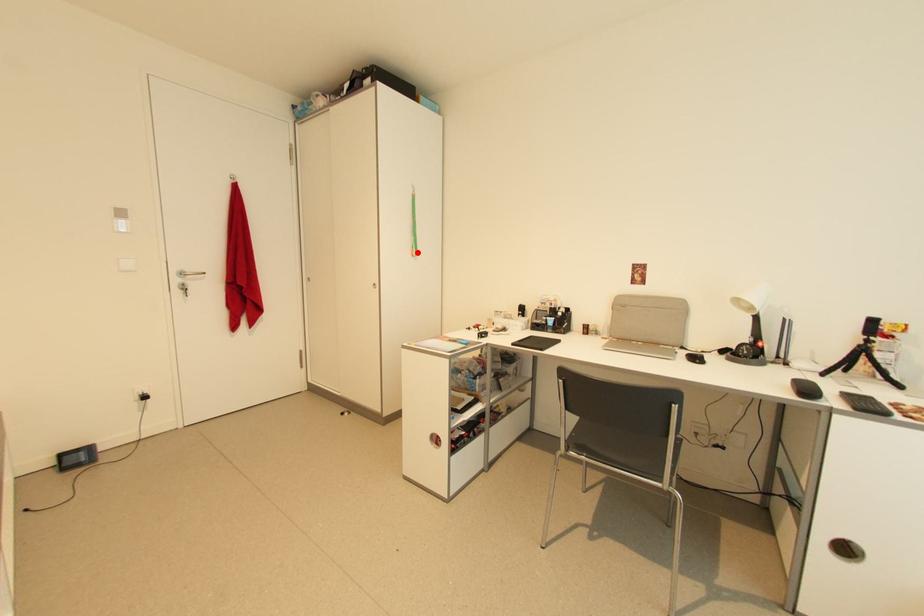
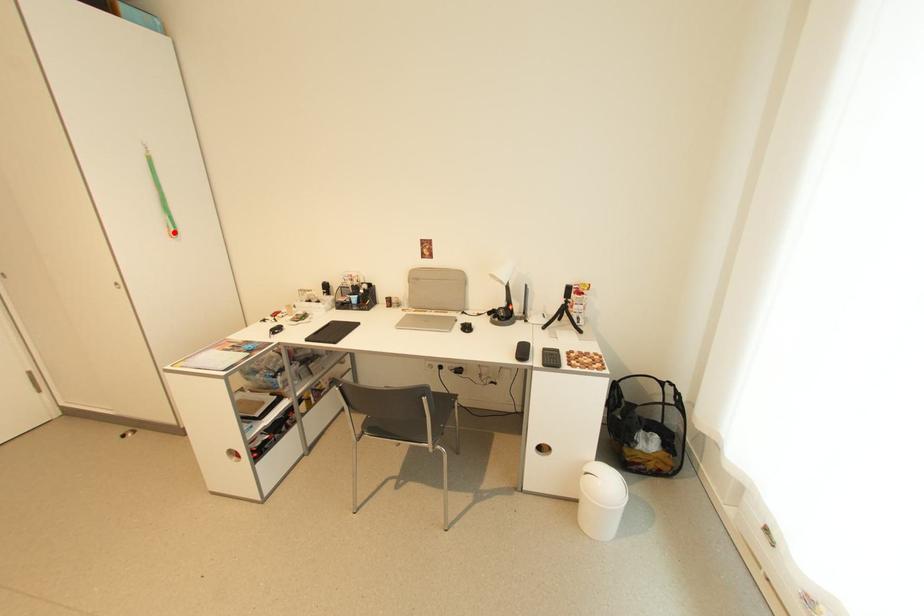
I am providing you with two images of the same scene from different viewpoints. A red point is marked on the first image and another point is marked on the second image. Is the marked point in image1 the same physical position as the marked point in image2?

Yes